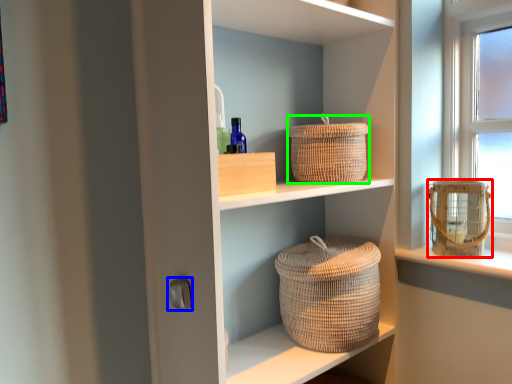
Question: Considering the real-world distances, which object is farthest from basket container (highlighted by a red box)? door handle (highlighted by a blue box) or basket (highlighted by a green box)?

Choices:
 (A) door handle
 (B) basket

Answer: (A)